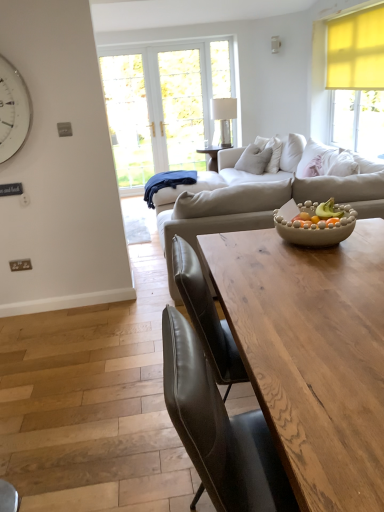
Question: Is light beige fabric pillow at center closer to camera compared to beige textured bowl at center?

Choices:
 (A) no
 (B) yes

Answer: (A)

Question: Does light beige fabric pillow at center turn towards beige textured bowl at center?

Choices:
 (A) yes
 (B) no

Answer: (B)

Question: Is light beige fabric pillow at center looking in the opposite direction of beige textured bowl at center?

Choices:
 (A) yes
 (B) no

Answer: (B)

Question: Considering the relative positions of light beige fabric pillow at center and beige textured bowl at center in the image provided, is light beige fabric pillow at center to the left of beige textured bowl at center from the viewer's perspective?

Choices:
 (A) no
 (B) yes

Answer: (A)

Question: Are light beige fabric pillow at center and beige textured bowl at center making contact?

Choices:
 (A) yes
 (B) no

Answer: (B)

Question: Considering the positions of point (256, 138) and point (296, 302), is point (256, 138) closer or farther from the camera than point (296, 302)?

Choices:
 (A) farther
 (B) closer

Answer: (A)

Question: Considering their positions, is light beige fabric pillow at center located in front of or behind wooden table at center?

Choices:
 (A) behind
 (B) front

Answer: (A)

Question: Looking at their shapes, would you say light beige fabric pillow at center is wider or thinner than wooden table at center?

Choices:
 (A) thin
 (B) wide

Answer: (A)

Question: Based on their sizes in the image, would you say light beige fabric pillow at center is bigger or smaller than wooden table at center?

Choices:
 (A) big
 (B) small

Answer: (B)

Question: Based on their sizes in the image, would you say beige fabric couch at center is bigger or smaller than light beige fabric pillow at center?

Choices:
 (A) big
 (B) small

Answer: (A)

Question: Is beige fabric couch at center in front of or behind light beige fabric pillow at center in the image?

Choices:
 (A) front
 (B) behind

Answer: (A)

Question: Is beige fabric couch at center to the left or to the right of light beige fabric pillow at center in the image?

Choices:
 (A) right
 (B) left

Answer: (B)

Question: From the image's perspective, is beige fabric couch at center positioned above or below light beige fabric pillow at center?

Choices:
 (A) above
 (B) below

Answer: (B)

Question: From a real-world perspective, relative to clear glass lamp at center, is beige textured bowl at center vertically above or below?

Choices:
 (A) above
 (B) below

Answer: (B)

Question: In terms of height, does beige textured bowl at center look taller or shorter compared to clear glass lamp at center?

Choices:
 (A) tall
 (B) short

Answer: (B)